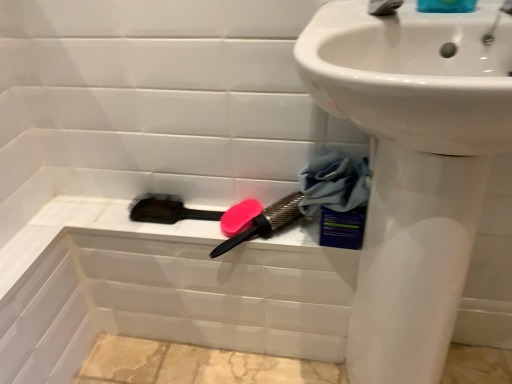
Question: Is blue fabric at lower right not inside black bristle brush at lower center, which ranks as the 1th brush in left-to-right order?

Choices:
 (A) yes
 (B) no

Answer: (A)

Question: Does blue fabric at lower right have a lesser width compared to black bristle brush at lower center, which ranks as the 1th brush in left-to-right order?

Choices:
 (A) no
 (B) yes

Answer: (A)

Question: Considering the relative sizes of blue fabric at lower right and black bristle brush at lower center, which ranks as the 1th brush in left-to-right order, in the image provided, is blue fabric at lower right taller than black bristle brush at lower center, which ranks as the 1th brush in left-to-right order,?

Choices:
 (A) no
 (B) yes

Answer: (B)

Question: Could you tell me if blue fabric at lower right is facing black bristle brush at lower center, which ranks as the 1th brush in left-to-right order?

Choices:
 (A) yes
 (B) no

Answer: (B)

Question: Does blue fabric at lower right lie in front of black bristle brush at lower center, positioned as the 2th brush in right-to-left order?

Choices:
 (A) yes
 (B) no

Answer: (A)

Question: From a real-world perspective, is blue fabric at lower right over black bristle brush at lower center, which ranks as the 1th brush in left-to-right order?

Choices:
 (A) no
 (B) yes

Answer: (B)

Question: Considering the relative sizes of blue fabric at lower right and silver metallic tap at upper right in the image provided, is blue fabric at lower right taller than silver metallic tap at upper right?

Choices:
 (A) no
 (B) yes

Answer: (B)

Question: Does blue fabric at lower right appear on the right side of silver metallic tap at upper right?

Choices:
 (A) no
 (B) yes

Answer: (A)

Question: Is blue fabric at lower right to the left of silver metallic tap at upper right from the viewer's perspective?

Choices:
 (A) no
 (B) yes

Answer: (B)

Question: Could you tell me if blue fabric at lower right is facing silver metallic tap at upper right?

Choices:
 (A) no
 (B) yes

Answer: (A)

Question: Is blue fabric at lower right oriented away from silver metallic tap at upper right?

Choices:
 (A) yes
 (B) no

Answer: (B)

Question: From a real-world perspective, is blue fabric at lower right located beneath silver metallic tap at upper right?

Choices:
 (A) yes
 (B) no

Answer: (A)

Question: Is blue glossy soap at upper right positioned in front of pink rubber brush at upper center, the 2th brush positioned from the left?

Choices:
 (A) yes
 (B) no

Answer: (A)